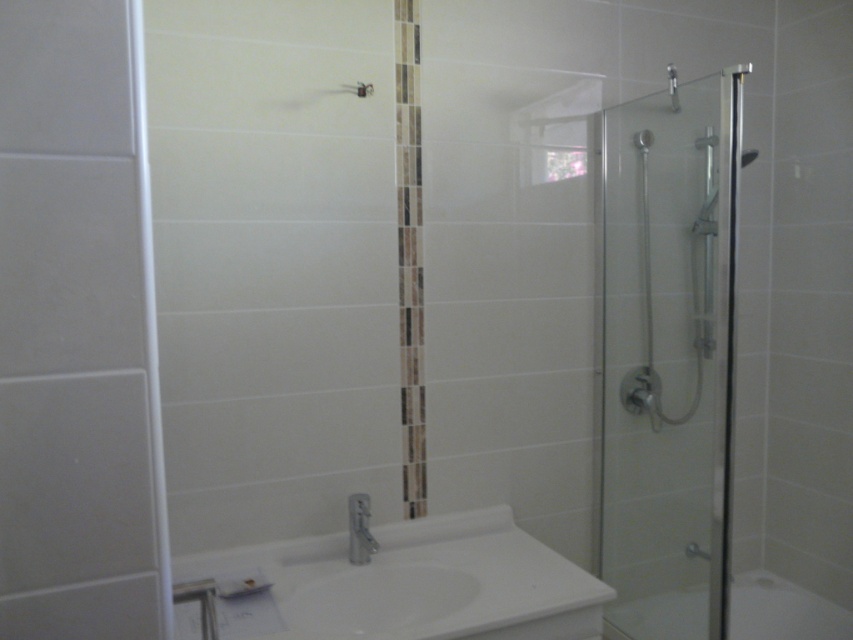
Question: Does white glossy sink at lower left appear on the right side of white glossy bathtub at lower right?

Choices:
 (A) no
 (B) yes

Answer: (A)

Question: Does white glossy sink at lower left appear on the left side of white glossy bathtub at lower right?

Choices:
 (A) no
 (B) yes

Answer: (B)

Question: Which object appears farthest from the camera in this image?

Choices:
 (A) transparent glass shower door at right
 (B) white glossy bathtub at lower right

Answer: (B)

Question: Does transparent glass shower door at right appear on the right side of white glossy sink at lower left?

Choices:
 (A) no
 (B) yes

Answer: (B)

Question: Based on their relative distances, which object is nearer to the white glossy bathtub at lower right?

Choices:
 (A) silver metallic faucet at lower center
 (B) transparent glass shower door at right

Answer: (B)

Question: Among these points, which one is farthest from the camera?

Choices:
 (A) (752, 611)
 (B) (670, 605)
 (C) (350, 548)
 (D) (369, 625)

Answer: (A)